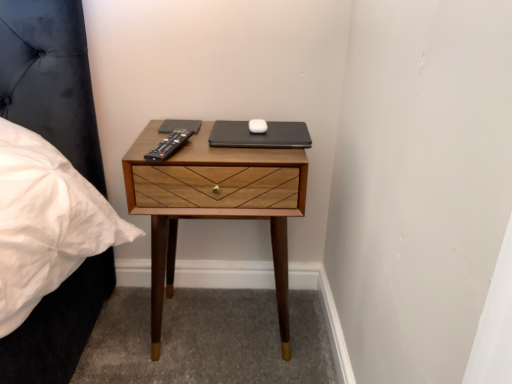
I want to click on free space between black plastic remote at center and black matte laptop at center, so click(x=222, y=143).